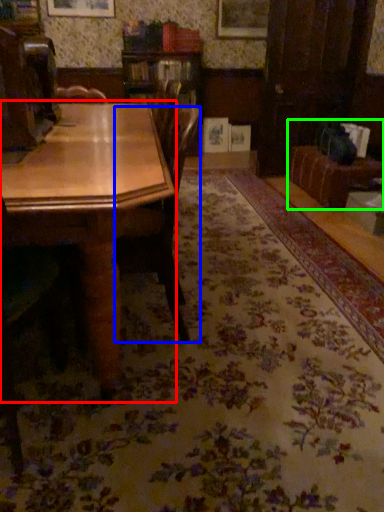
Question: Which object is positioned closest to table (highlighted by a red box)? Select from chair (highlighted by a blue box) and couch (highlighted by a green box).

Choices:
 (A) chair
 (B) couch

Answer: (A)